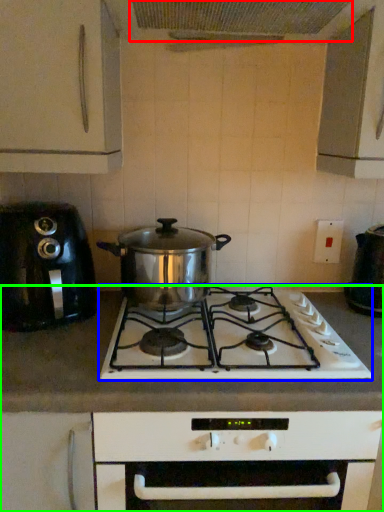
Question: Estimate the real-world distances between objects in this image. Which object is farther from exhaust hood (highlighted by a red box), gas stove (highlighted by a blue box) or countertop (highlighted by a green box)?

Choices:
 (A) gas stove
 (B) countertop

Answer: (B)